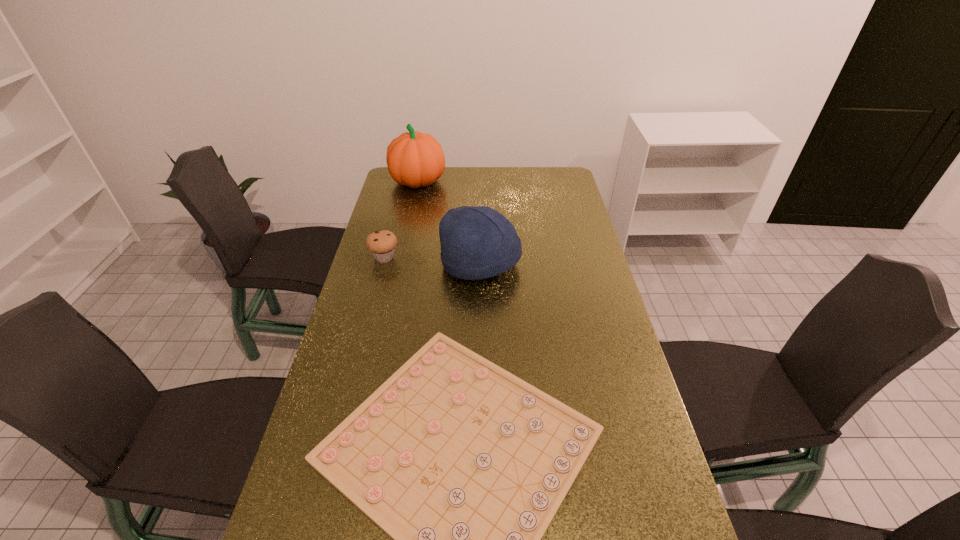
Identify the location of the tallest object. (414, 159).

I want to click on pumpkin, so pyautogui.click(x=414, y=159).

Find the location of a particular element. skullcap is located at coordinates (479, 242).

The image size is (960, 540). Find the location of `muffin`. muffin is located at coordinates click(382, 244).

You are a GUI agent. You are given a task and a screenshot of the screen. Output one action in this format:
    pyautogui.click(x=<x>, y=<y>)
    Task: Click on the vacant space situated on the front of the tallest object
    This screenshot has height=540, width=960.
    Given the screenshot: What is the action you would take?
    [411, 213]

I want to click on vacant space located on the left of the third shortest object, so click(x=400, y=265).

Find the location of a particular element. Image resolution: width=960 pixels, height=540 pixels. free location located on the back of the second shortest object is located at coordinates (389, 240).

The height and width of the screenshot is (540, 960). Identify the location of object that is at the far edge. (414, 159).

Where is `pumpkin present at the left edge`? The height and width of the screenshot is (540, 960). pumpkin present at the left edge is located at coordinates (414, 159).

Image resolution: width=960 pixels, height=540 pixels. I want to click on muffin present at the left edge, so click(x=382, y=244).